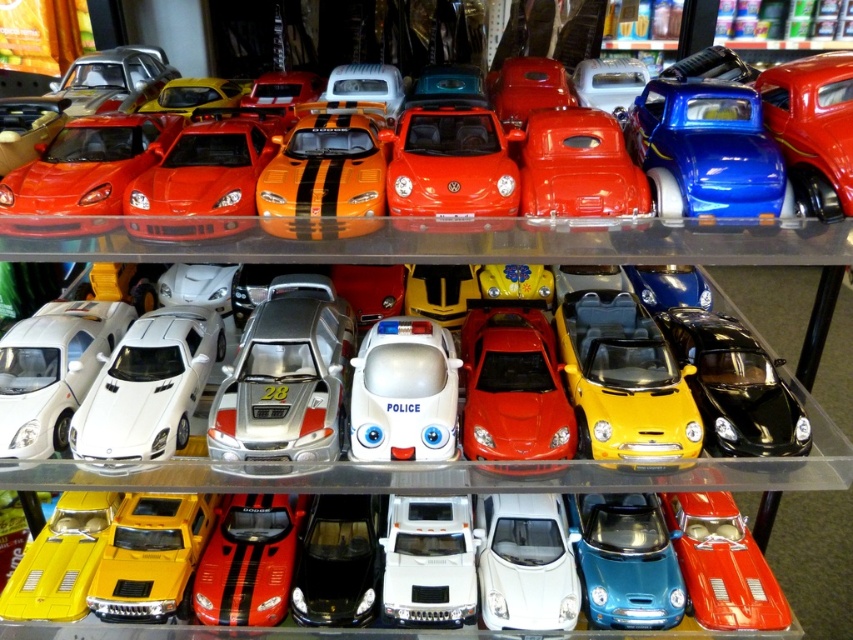
From the picture: You are a customer trying to decide which toy car to buy. The white plastic police car at center and the shiny red car at center are both on the same shelf. Which one is taller?

The shiny red car at center is taller than the white plastic police car at center.

You are a customer in the store and want to locate the glossy red car at center. Based on the coordinates provided, which section of the shelf should you look in?

The glossy red car at center is located at coordinates point (x=514, y=387), which corresponds to the top row of the shelf.